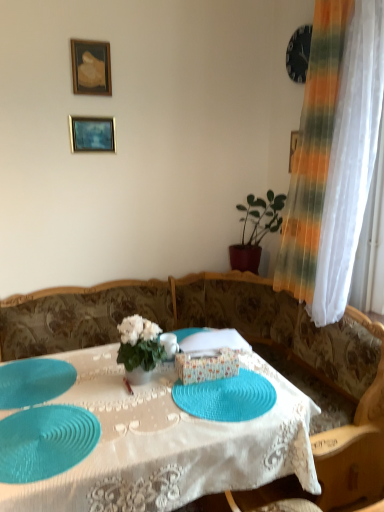
What are the coordinates of `vacant space in white fabric flower at center (from a real-world perspective)` in the screenshot? It's located at (153, 376).